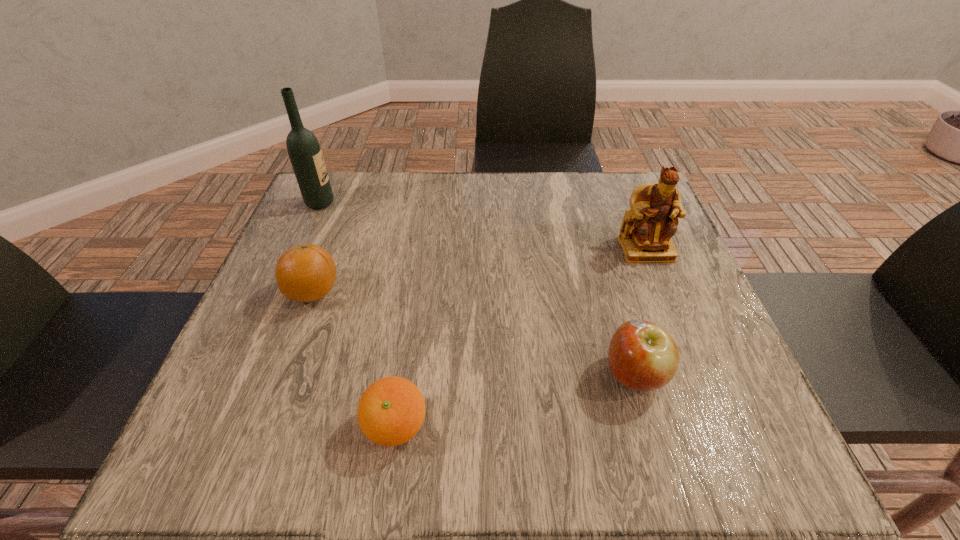
You are a GUI agent. You are given a task and a screenshot of the screen. Output one action in this format:
    pyautogui.click(x=<x>, y=<y>)
    Task: Click on the object that is at the far left corner
    This screenshot has height=540, width=960.
    Given the screenshot: What is the action you would take?
    pyautogui.click(x=304, y=151)

Locate an element on the screen. This screenshot has width=960, height=540. vacant area at the far edge is located at coordinates (448, 224).

In the image, there is a desktop. At what (x,y) coordinates should I click in order to perform the action: click on vacant region at the near edge. Please return your answer as a coordinate pair (x, y). Looking at the image, I should click on (445, 422).

You are a GUI agent. You are given a task and a screenshot of the screen. Output one action in this format:
    pyautogui.click(x=<x>, y=<y>)
    Task: Click on the free spot at the left edge of the desktop
    The image size is (960, 540).
    Given the screenshot: What is the action you would take?
    pyautogui.click(x=297, y=395)

Locate an element on the screen. free spot at the right edge of the desktop is located at coordinates (683, 369).

In the image, there is a desktop. Identify the location of vacant space at the far left corner. coord(352,209).

This screenshot has width=960, height=540. What are the coordinates of `vacant region at the near right corner of the desktop` in the screenshot? It's located at (769, 470).

Find the location of a particular element. vacant space in between the shorter orange and the farther orange is located at coordinates (355, 359).

Locate an element on the screen. blank region between the farthest object and the nearer orange is located at coordinates (358, 315).

Identify the location of free space between the wine bottle and the third object from left to right. (358, 315).